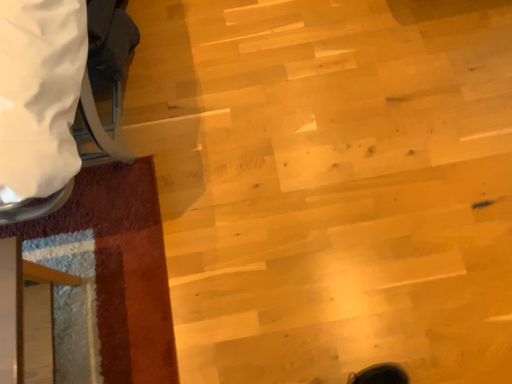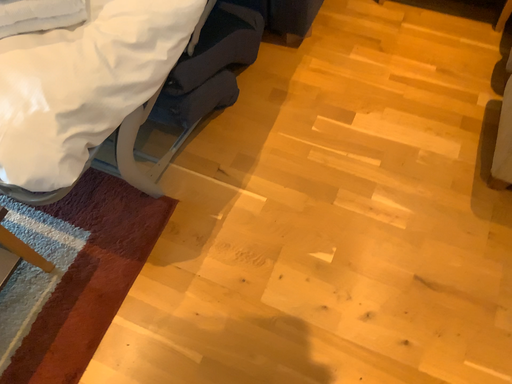
Question: Which way did the camera rotate in the video?

Choices:
 (A) rotated downward
 (B) rotated upward

Answer: (B)